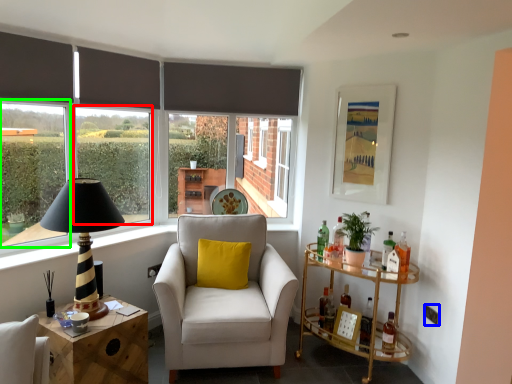
Question: Which is nearer to the window (highlighted by a red box)? power outlet (highlighted by a blue box) or window screen (highlighted by a green box).

Choices:
 (A) power outlet
 (B) window screen

Answer: (B)